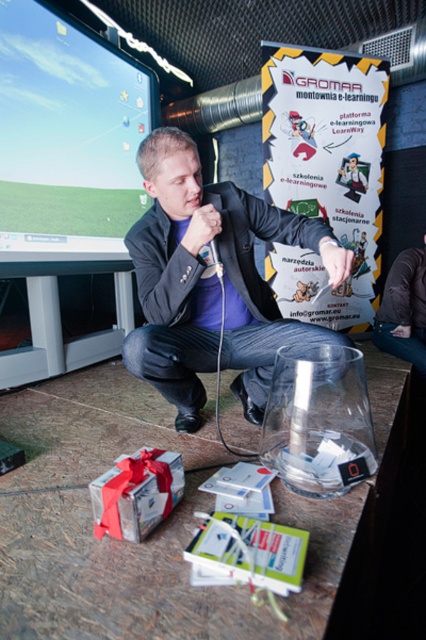
Does matte black jacket at center appear over matte black monitor at upper left?

No.

Is point (175, 336) farther from camera compared to point (144, 116)?

No.

What are the coordinates of `matte black jacket at center` in the screenshot? It's located at (212, 282).

Image resolution: width=426 pixels, height=640 pixels. Identify the location of matte black jacket at center. (212, 282).

From the picture: Which of these two, matte black monitor at upper left or metallic silver game controller at center, stands taller?

Standing taller between the two is matte black monitor at upper left.

At what (x,y) coordinates should I click in order to perform the action: click on matte black monitor at upper left. Please return your answer as a coordinate pair (x, y). Looking at the image, I should click on (66, 134).

Where is `matte black jacket at center`? matte black jacket at center is located at coordinates (212, 282).

Can you confirm if matte black jacket at center is bigger than metallic silver game controller at center?

Yes, matte black jacket at center is bigger than metallic silver game controller at center.

Does point (238, 381) come in front of point (207, 244)?

That is False.

Find the location of a particular element. The height and width of the screenshot is (640, 426). matte black jacket at center is located at coordinates (212, 282).